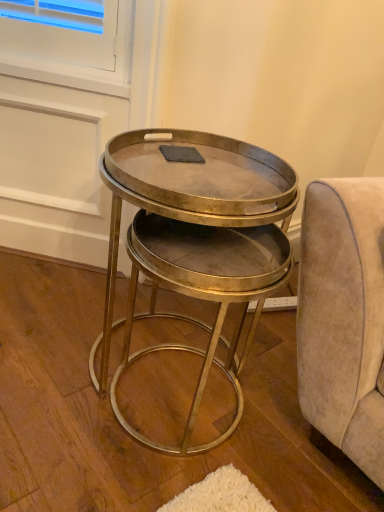
Question: In terms of size, does metallic gold table at center appear bigger or smaller than gray matte rectangular pad at center?

Choices:
 (A) small
 (B) big

Answer: (B)

Question: Is point (231, 155) closer or farther from the camera than point (177, 146)?

Choices:
 (A) farther
 (B) closer

Answer: (A)

Question: From their relative heights in the image, would you say metallic gold table at center is taller or shorter than gray matte rectangular pad at center?

Choices:
 (A) tall
 (B) short

Answer: (A)

Question: From a real-world perspective, relative to metallic gold table at center, is gray matte rectangular pad at center vertically above or below?

Choices:
 (A) below
 (B) above

Answer: (B)

Question: Is gray matte rectangular pad at center bigger or smaller than metallic gold table at center?

Choices:
 (A) big
 (B) small

Answer: (B)

Question: Which is correct: gray matte rectangular pad at center is inside metallic gold table at center, or outside of it?

Choices:
 (A) inside
 (B) outside

Answer: (B)

Question: Considering the relative positions of gray matte rectangular pad at center and metallic gold table at center in the image provided, is gray matte rectangular pad at center to the left or to the right of metallic gold table at center?

Choices:
 (A) left
 (B) right

Answer: (A)